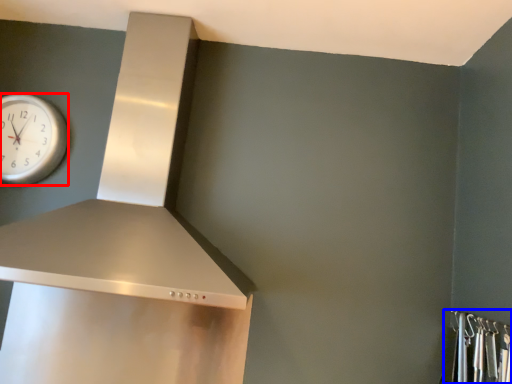
Question: Which object appears farthest to the camera in this image, wall clock (highlighted by a red box) or closet (highlighted by a blue box)?

Choices:
 (A) wall clock
 (B) closet

Answer: (A)